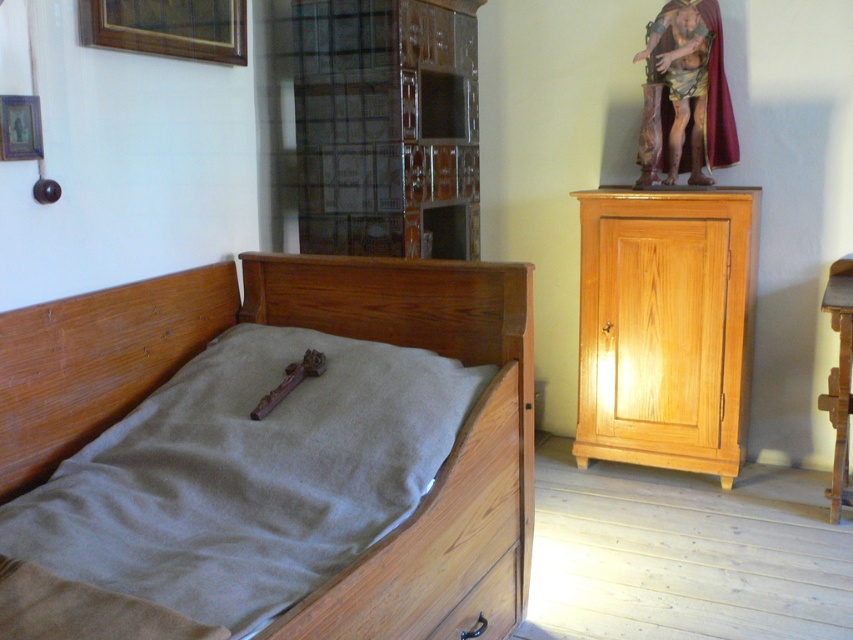
You are a delivery person who needs to place a box that is 1.5 meters long between the light brown wood cabinet at right and the wooden drawer at lower center. Is there enough space between them to fit the box?

The distance between the light brown wood cabinet at right and the wooden drawer at lower center is 1.33 meters. Since the box is 1.5 meters long, it is longer than the available space, so the box cannot fit between them.

You are standing in the room and want to place a small candle on the wooden drawer at lower center. Can you tell me the exact coordinates where you should place the candle?

The wooden drawer at lower center is located at coordinates point (486,604), so you should place the candle there.

In the scene shown: You are an interior designer planning to place a new decorative item between the wooden bed at left and the wooden crucifix at center. Considering their sizes, which object should the new item be placed closer to for balance?

The wooden bed at left is larger than the wooden crucifix at center, so the new decorative item should be placed closer to the wooden crucifix at center to achieve balance.